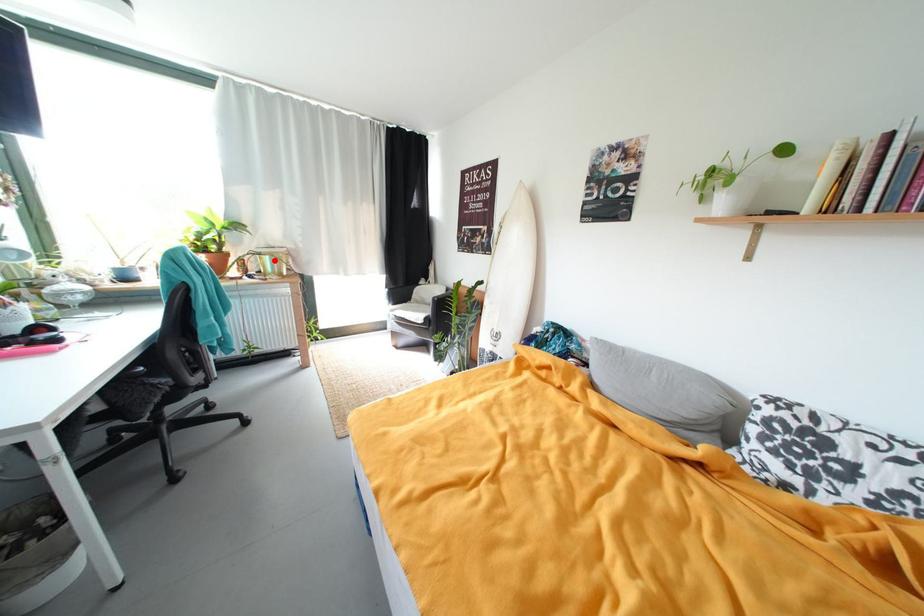
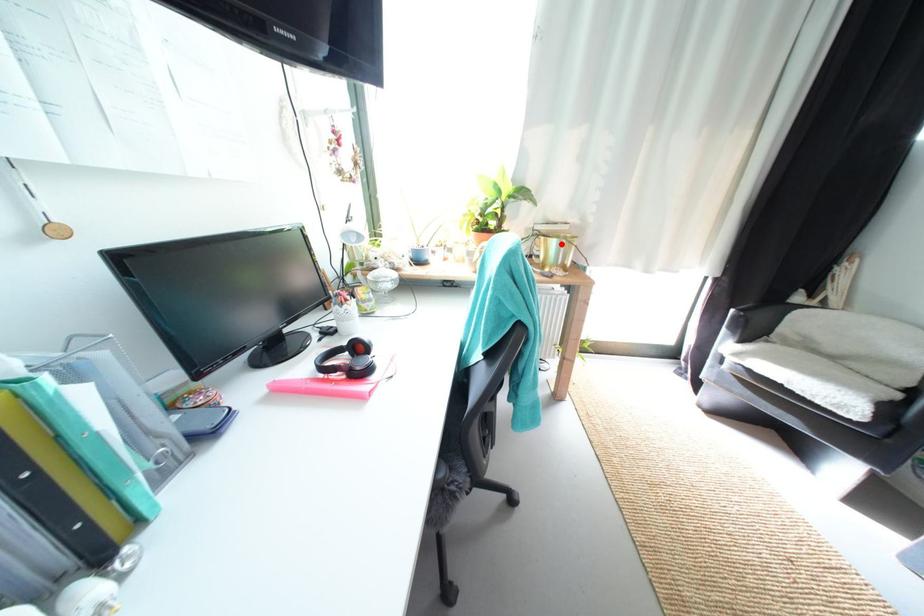
I am providing you with two images of the same scene from different viewpoints. A red point is marked on the first image and another point is marked on the second image. Are the points marked in image1 and image2 representing the same 3D position?

Yes